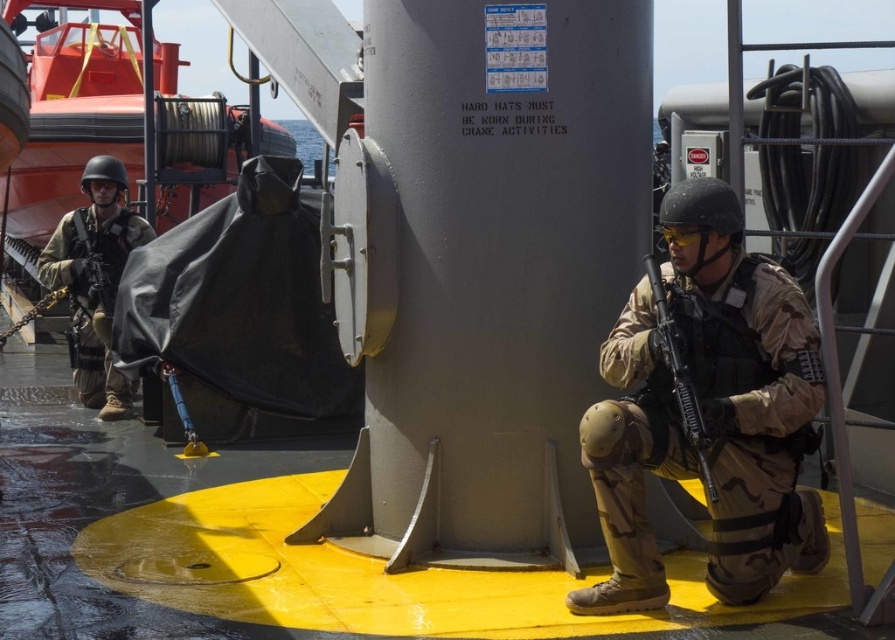
The image size is (895, 640). Describe the element at coordinates (746, 390) in the screenshot. I see `camouflage fabric uniform at center` at that location.

Does camouflage fabric uniform at center appear on the left side of brushed metal lifeboat at left?

No, camouflage fabric uniform at center is not to the left of brushed metal lifeboat at left.

Which is in front, point (786, 333) or point (75, 70)?

Point (786, 333) is in front.

The image size is (895, 640). I want to click on camouflage fabric uniform at center, so click(x=746, y=390).

Does point (118, 164) come farther from viewer compared to point (659, 269)?

Yes, point (118, 164) is behind point (659, 269).

Who is taller, camouflage fabric uniform at left or matte black rifle at center?

camouflage fabric uniform at left

Does point (109, 164) come closer to viewer compared to point (686, 412)?

No, it is not.

Where is `camouflage fabric uniform at left`? camouflage fabric uniform at left is located at coordinates (95, 280).

Who is taller, camouflage fabric uniform at center or camouflage fabric uniform at left?

camouflage fabric uniform at left

Between point (625, 589) and point (86, 372), which one is positioned in front?

Point (625, 589) is more forward.

Locate an element on the screen. The image size is (895, 640). camouflage fabric uniform at center is located at coordinates coord(746,390).